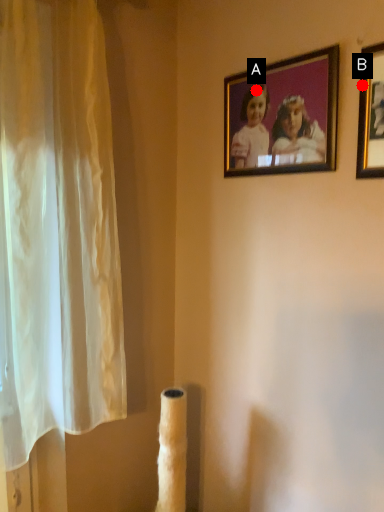
Question: Two points are circled on the image, labeled by A and B beside each circle. Among these points, which one is nearest to the camera?

Choices:
 (A) A is closer
 (B) B is closer

Answer: (B)